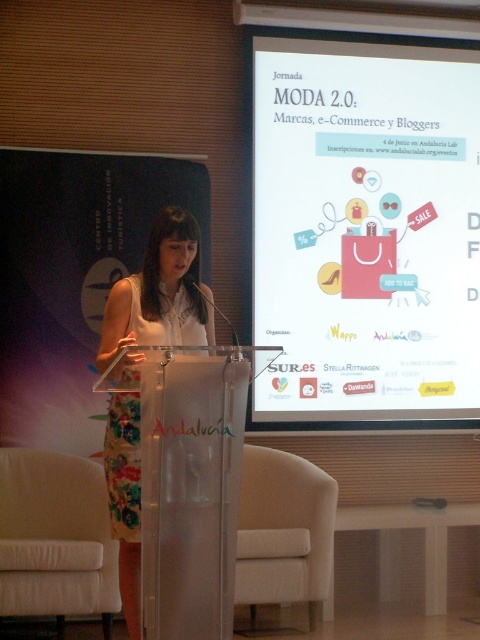
You are a photographer at the event and need to capture a photo where both the white paper at upper center and the floral fabric dress at center are in focus. Given that your camera has a depth of field that can cover 2 meters, will you be able to achieve this?

The distance between the white paper at upper center and the floral fabric dress at center is 1.81 meters, which is within the camera depth of field of 2 meters. Therefore, both objects can be in focus in the photo.

You are an event planner checking the stage setup. You need to ensure that the white paper at upper center and the floral fabric dress at center do not overlap in the camera frame. Given their widths, which object should be moved to avoid overlap?

The white paper at upper center is wider than the floral fabric dress at center. To avoid overlap, the floral fabric dress at center should be moved since it is narrower and easier to adjust within the frame.

You are an attendee at this event and want to take a photo of the floral fabric dress at center and the white paper at upper center. Which object should you focus on first to ensure both are in frame?

You should focus on the floral fabric dress at center first because the white paper at upper center is to the right of it, so by centering the dress, the paper will naturally be in the frame to its right.